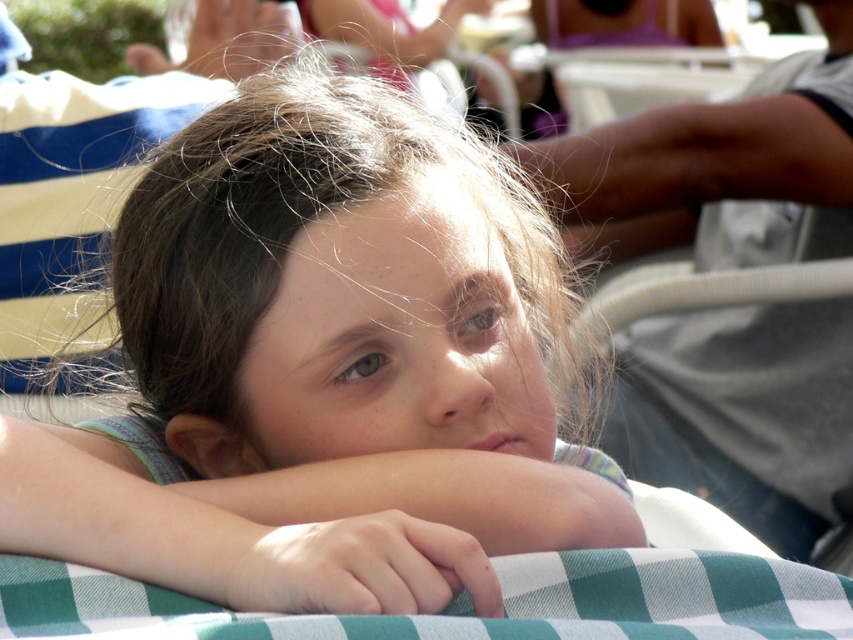
Question: Is the position of smooth skin arm at lower center more distant than that of green checkered fabric at center?

Choices:
 (A) no
 (B) yes

Answer: (B)

Question: Among these points, which one is nearest to the camera?

Choices:
 (A) (448, 532)
 (B) (738, 602)
 (C) (259, 403)

Answer: (A)

Question: Does smooth skin child at center have a larger size compared to smooth skin arm at lower center?

Choices:
 (A) yes
 (B) no

Answer: (A)

Question: Which point is closer to the camera?

Choices:
 (A) green checkered fabric at center
 (B) smooth skin arm at lower center
 (C) smooth skin child at center

Answer: (A)

Question: Can you confirm if smooth skin child at center is positioned to the right of smooth skin arm at lower center?

Choices:
 (A) yes
 (B) no

Answer: (A)

Question: Based on their relative distances, which object is farther from the smooth skin arm at lower center?

Choices:
 (A) green checkered fabric at center
 (B) smooth skin child at center

Answer: (B)